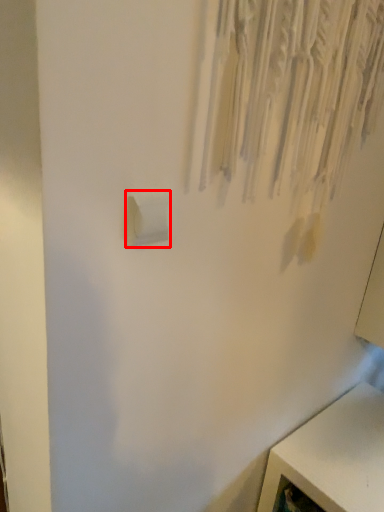
Question: Where is light switch (annotated by the red box) located in relation to furniture in the image?

Choices:
 (A) left
 (B) right

Answer: (A)